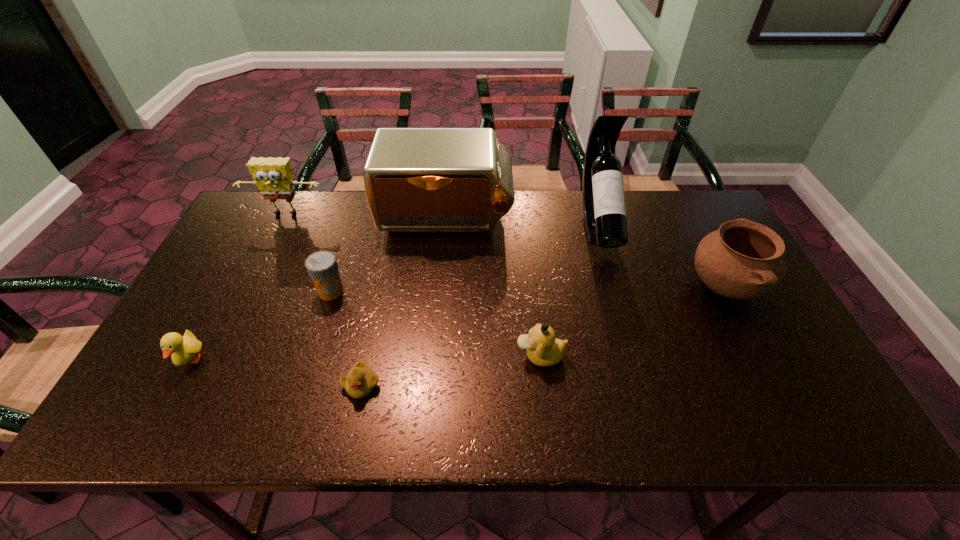
You are a GUI agent. You are given a task and a screenshot of the screen. Output one action in this format:
    pyautogui.click(x=<x>, y=<y>)
    Task: Click on the tallest object
    Image resolution: width=960 pixels, height=540 pixels.
    Given the screenshot: What is the action you would take?
    pyautogui.click(x=604, y=213)

Find the location of a particular element. The height and width of the screenshot is (540, 960). the seventh object from left to right is located at coordinates (604, 213).

At what (x,y) coordinates should I click in order to perform the action: click on the second tallest object. Please return your answer as a coordinate pair (x, y). Image resolution: width=960 pixels, height=540 pixels. Looking at the image, I should click on point(416,179).

Where is `sponge`? The image size is (960, 540). sponge is located at coordinates (273, 176).

Find the location of `pottery`. pottery is located at coordinates (742, 260).

Where is `the rightmost duckling`? the rightmost duckling is located at coordinates (543, 348).

At what (x,y) coordinates should I click in order to perform the action: click on the sixth object from right to left. Please return your answer as a coordinate pair (x, y). Looking at the image, I should click on (322, 267).

Identify the location of the leftmost duckling. The width and height of the screenshot is (960, 540). (183, 349).

Where is `the shortest object`? the shortest object is located at coordinates (360, 381).

At what (x,y) coordinates should I click in order to perform the action: click on the second duckling from right to left. Please return your answer as a coordinate pair (x, y). Image resolution: width=960 pixels, height=540 pixels. Looking at the image, I should click on (360, 381).